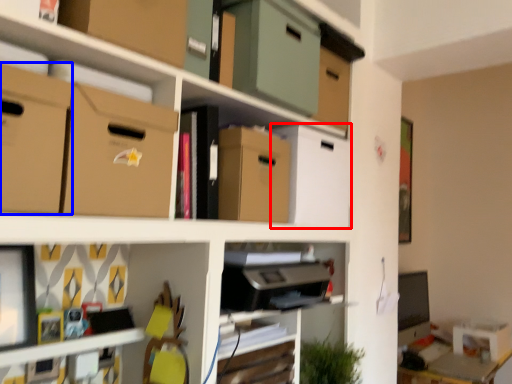
Question: Which object appears closest to the camera in this image, storage box (highlighted by a red box) or cardboard box (highlighted by a blue box)?

Choices:
 (A) storage box
 (B) cardboard box

Answer: (B)